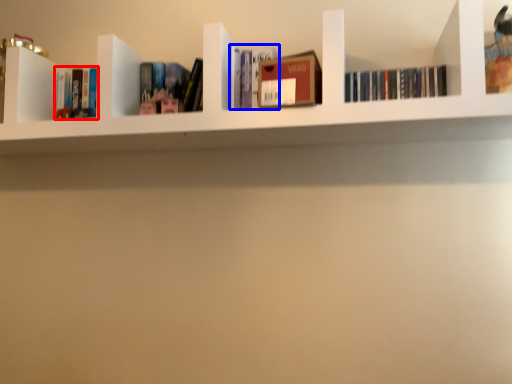
Question: Which of the following is the farthest to the observer, book (highlighted by a red box) or book (highlighted by a blue box)?

Choices:
 (A) book
 (B) book

Answer: (A)